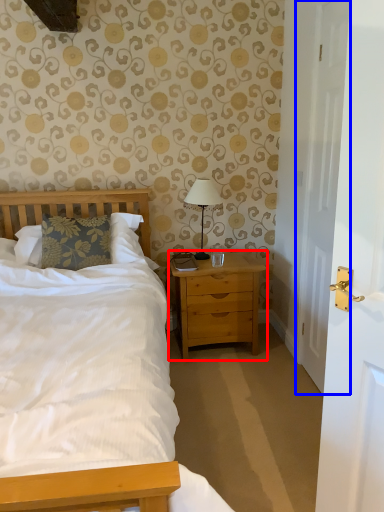
Question: Among these objects, which one is nearest to the camera, nightstand (highlighted by a red box) or door (highlighted by a blue box)?

Choices:
 (A) nightstand
 (B) door

Answer: (B)